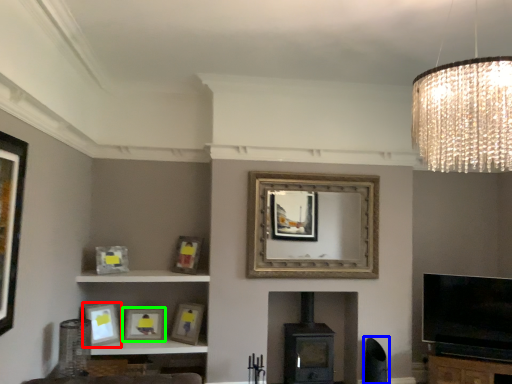
Question: Based on their relative distances, which object is farther from picture frame (highlighted by a red box)? Choose from swivel chair (highlighted by a blue box) and picture frame (highlighted by a green box).

Choices:
 (A) swivel chair
 (B) picture frame

Answer: (A)